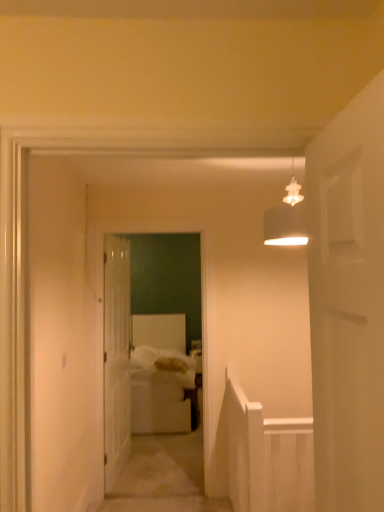
What are the coordinates of `blank space above white fabric bed at center (from a real-world perspective)` in the screenshot? It's located at (155, 218).